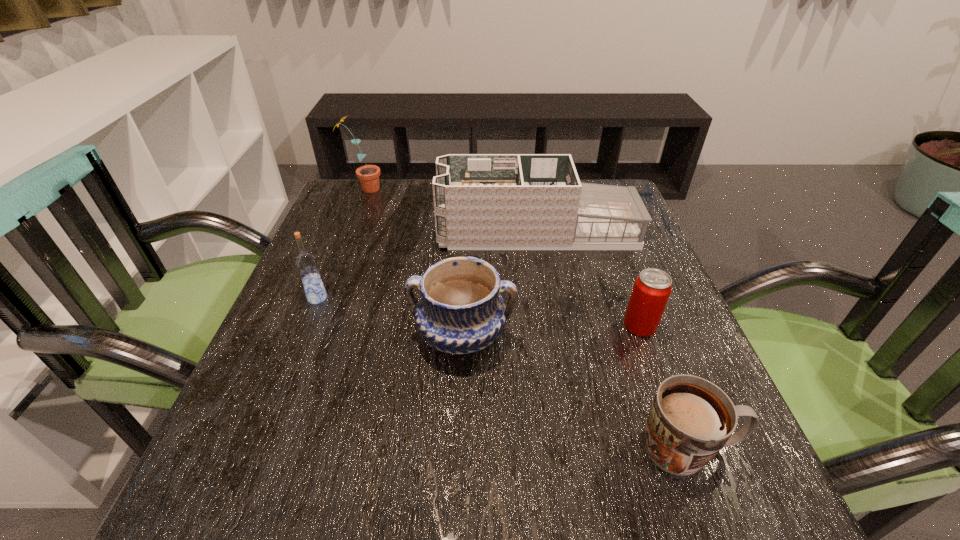
Image resolution: width=960 pixels, height=540 pixels. I want to click on the farthest object, so click(368, 175).

Image resolution: width=960 pixels, height=540 pixels. What are the coordinates of `the tallest object` in the screenshot? It's located at [x=368, y=175].

I want to click on dollhouse, so click(481, 201).

This screenshot has width=960, height=540. What are the coordinates of `vodka` in the screenshot? It's located at (306, 263).

You are a GUI agent. You are given a task and a screenshot of the screen. Output one action in this format:
    pyautogui.click(x=<x>, y=<y>)
    Task: Click on the pottery
    
    Given the screenshot: What is the action you would take?
    pyautogui.click(x=461, y=311)

Find the location of `can`. can is located at coordinates (652, 288).

The height and width of the screenshot is (540, 960). Identify the location of mug. (690, 420).

Locate an element on the screen. vacant region located 0.080m on the flower of the tallest object is located at coordinates (412, 189).

Image resolution: width=960 pixels, height=540 pixels. Find the location of `vacant space positioned 0.180m at the entrance of the second farthest object`. vacant space positioned 0.180m at the entrance of the second farthest object is located at coordinates (364, 232).

I want to click on vacant region located at the entrance of the second farthest object, so click(x=340, y=232).